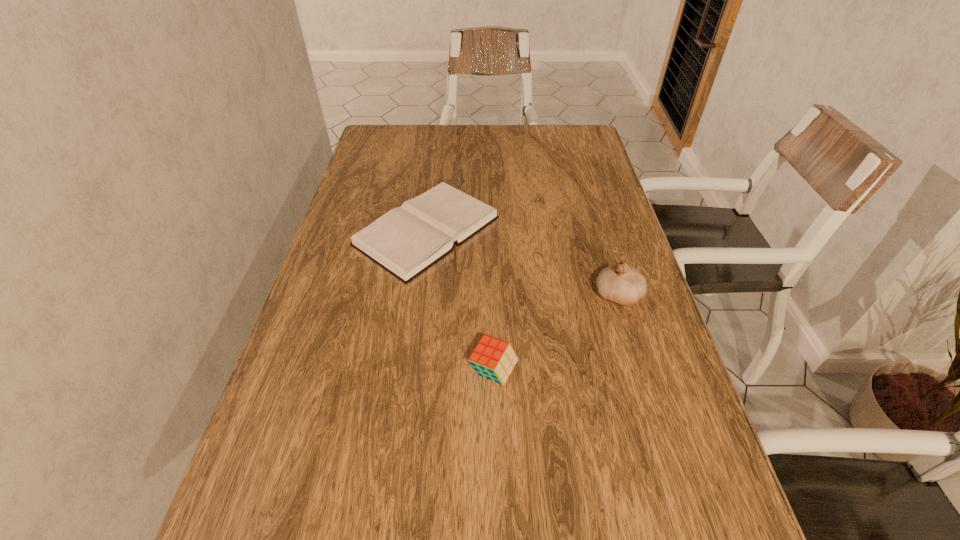
At what (x,y) coordinates should I click in order to perform the action: click on the rightmost object. Please return your answer as a coordinate pair (x, y). The width and height of the screenshot is (960, 540). Looking at the image, I should click on (621, 283).

Image resolution: width=960 pixels, height=540 pixels. I want to click on garlic, so click(621, 283).

The height and width of the screenshot is (540, 960). Identify the location of cube. (492, 358).

Find the location of a particular element. The width and height of the screenshot is (960, 540). the nearest object is located at coordinates (492, 358).

Where is `hardback book`? This screenshot has height=540, width=960. hardback book is located at coordinates (407, 240).

Find the location of a particular element. vacant space situated on the back of the rightmost object is located at coordinates (607, 257).

Where is `vacant space located on the back of the cube`? vacant space located on the back of the cube is located at coordinates (491, 263).

Identify the location of free location located 0.350m on the back of the hardback book. (441, 133).

Find the location of a particular element. This screenshot has width=960, height=540. object at the left edge is located at coordinates (407, 240).

The height and width of the screenshot is (540, 960). What are the coordinates of `object at the right edge` in the screenshot? It's located at (621, 283).